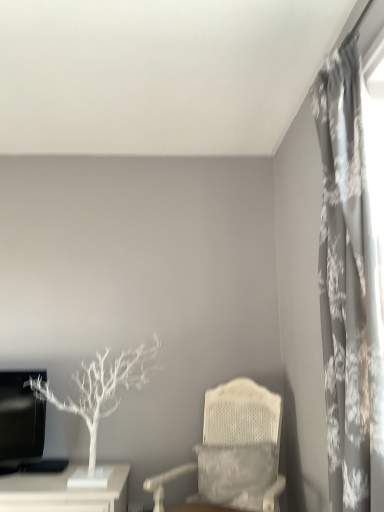
Question: From a real-world perspective, is white matte tree at left physically located above or below gray floral fabric curtain at right?

Choices:
 (A) above
 (B) below

Answer: (B)

Question: Is white matte tree at left bigger or smaller than gray floral fabric curtain at right?

Choices:
 (A) small
 (B) big

Answer: (B)

Question: Which object is the farthest from the white matte tree at left?

Choices:
 (A) white matte table at lower left
 (B) gray floral fabric curtain at right
 (C) white textured chair at center

Answer: (B)

Question: Based on their relative distances, which object is farther from the gray floral fabric curtain at right?

Choices:
 (A) white matte tree at left
 (B) white matte table at lower left
 (C) white textured chair at center

Answer: (B)